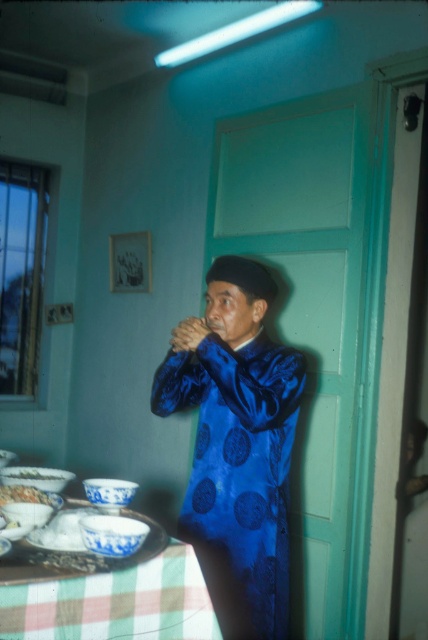
You are standing in the room and want to place a small object on the table. Which of the two points, point (x=168, y=609) or point (x=56, y=476), is closer to you?

Point (x=168, y=609) is closer to the viewer than point (x=56, y=476).

You are a guest at a dinner party and want to reach for the white glossy bowl at lower left. Considering your arm length is 0.64 meters, can you comfortably reach the bowl without moving your position?

The white glossy bowl at lower left is 1.64 meters from the viewer. Since your arm length is 0.64 meters, you cannot comfortably reach the bowl without moving your position.

You are a delivery person who needs to place a package on the table. The package is 12 inches wide. There is a shiny blue robe at center and a white porcelain bowl at lower left on the table. Can you fit the package between them without moving either object?

The shiny blue robe at center and white porcelain bowl at lower left are 26.32 inches apart. Since the package is only 12 inches wide, there is enough space between them to place the package without moving either object.